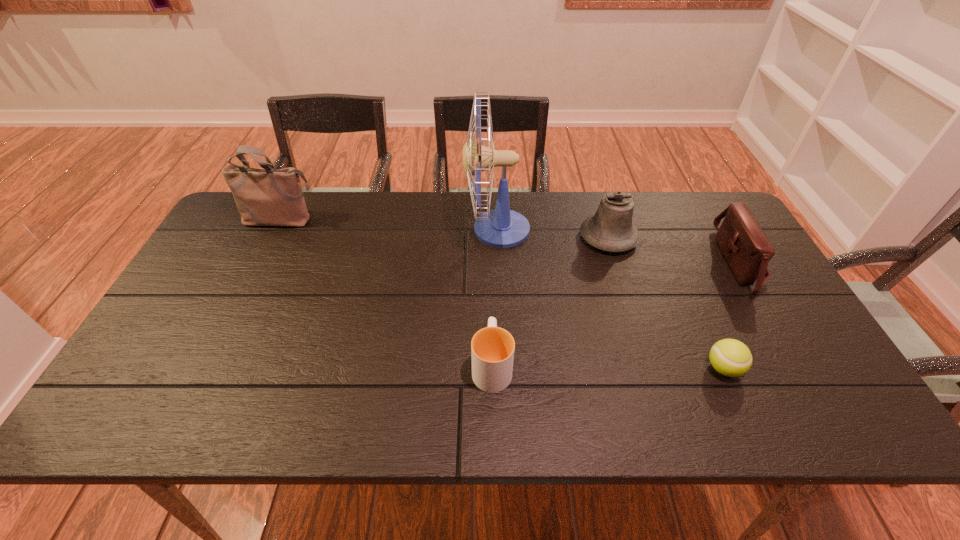
Locate an element on the screen. The image size is (960, 540). free region located 0.280m at the front of the tallest object where the blades are visible is located at coordinates (376, 230).

You are a GUI agent. You are given a task and a screenshot of the screen. Output one action in this format:
    pyautogui.click(x=<x>, y=<y>)
    Task: Click on the vacant space positioned 0.260m at the front of the tallest object where the blades are visible
    The height and width of the screenshot is (540, 960).
    Given the screenshot: What is the action you would take?
    point(382,230)

I want to click on free space located 0.120m on the front-facing side of the taller shoulder bag, so click(263, 257).

Locate an element on the screen. vacant area located on the front of the bell is located at coordinates (636, 325).

Where is `vacant region located 0.390m on the front flap of the fourth tallest object`? The image size is (960, 540). vacant region located 0.390m on the front flap of the fourth tallest object is located at coordinates (588, 262).

Image resolution: width=960 pixels, height=540 pixels. What are the coordinates of `free space located on the front flap of the fourth tallest object` in the screenshot? It's located at (618, 262).

Image resolution: width=960 pixels, height=540 pixels. I want to click on vacant space situated 0.370m on the front flap of the fourth tallest object, so click(x=594, y=262).

This screenshot has width=960, height=540. I want to click on free point located 0.350m with the handle on the side of the fifth tallest object, so click(490, 245).

The image size is (960, 540). Identify the location of free region located with the handle on the side of the fifth tallest object. (491, 309).

Image resolution: width=960 pixels, height=540 pixels. I want to click on vacant space situated with the handle on the side of the fifth tallest object, so click(490, 261).